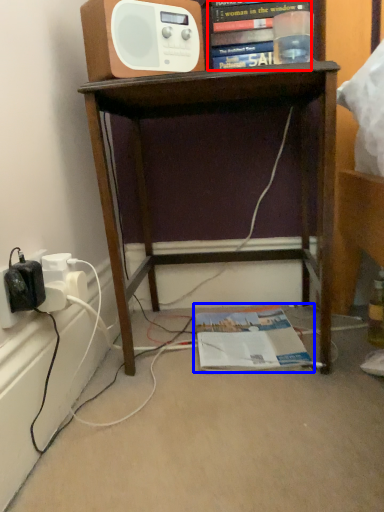
Question: Among these objects, which one is farthest to the camera, book (highlighted by a red box) or magazine (highlighted by a blue box)?

Choices:
 (A) book
 (B) magazine

Answer: (B)